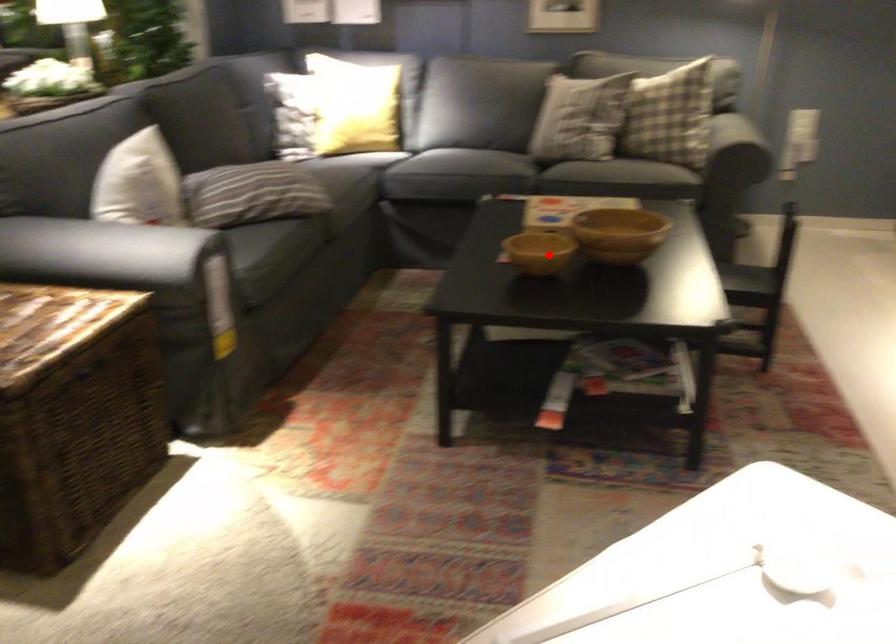
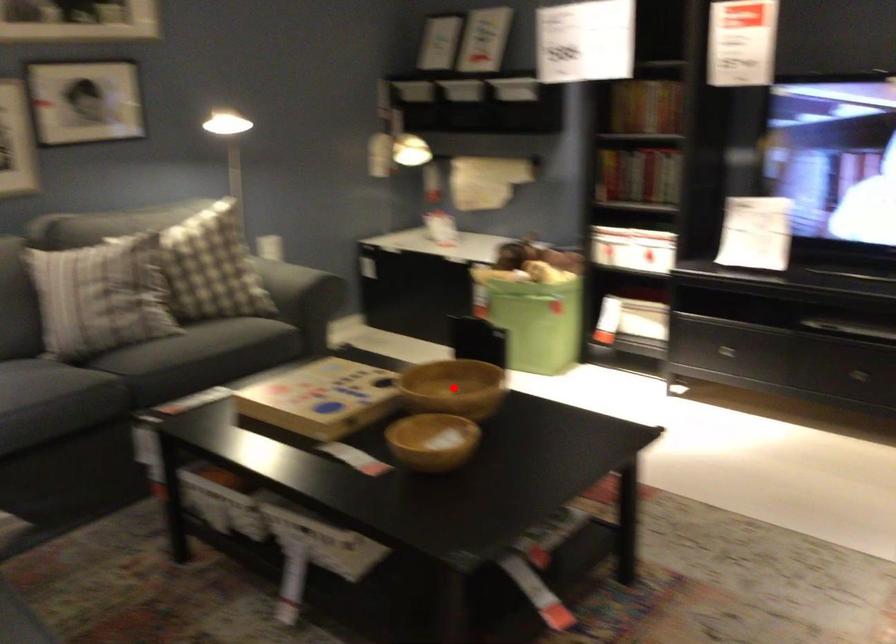
I am providing you with two images of the same scene from different viewpoints. A red point is marked on the first image and another point is marked on the second image. Are the points marked in image1 and image2 representing the same 3D position?

No